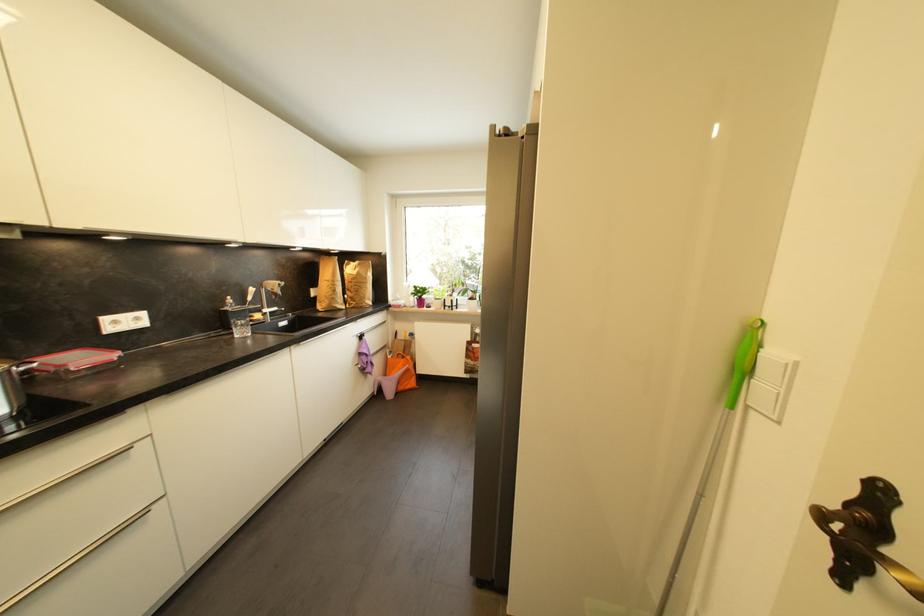
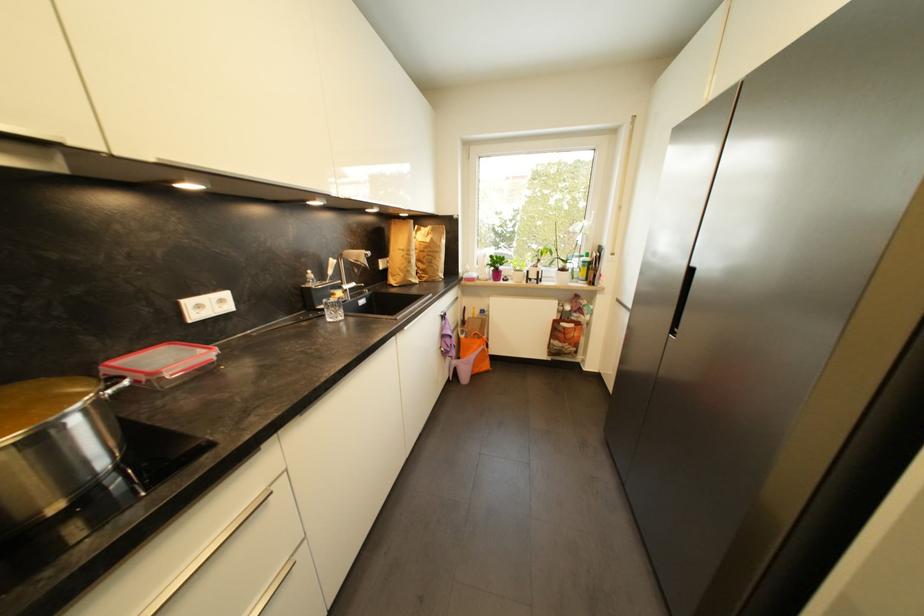
Where in the second image is the point corresponding to point 358,281 from the first image?

(430, 249)